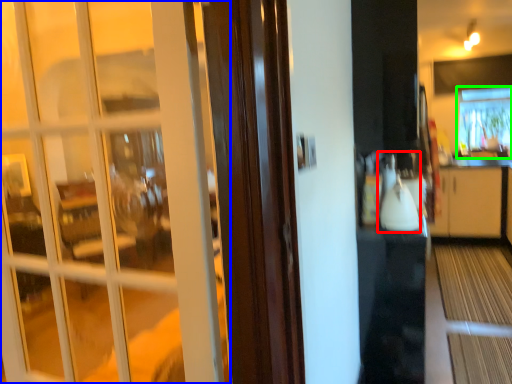
Question: Estimate the real-world distances between objects in this image. Which object is farther from appliance (highlighted by a red box), door (highlighted by a blue box) or window (highlighted by a green box)?

Choices:
 (A) door
 (B) window

Answer: (B)